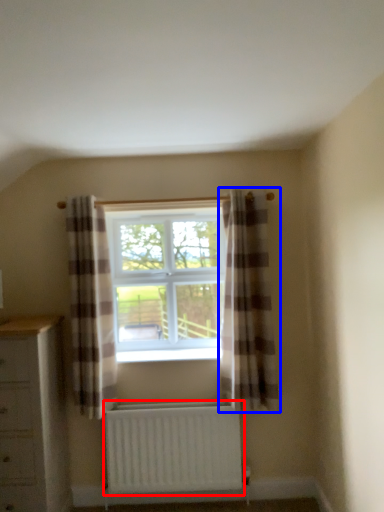
Question: Which of the following is the farthest to the observer, radiator (highlighted by a red box) or curtain (highlighted by a blue box)?

Choices:
 (A) radiator
 (B) curtain

Answer: (A)